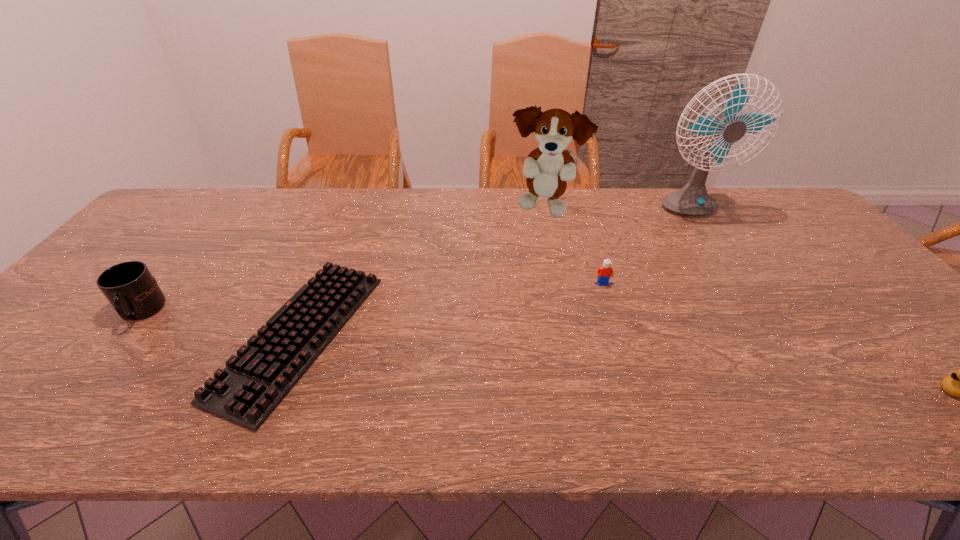
Locate an element on the screen. This screenshot has width=960, height=540. vacant space located 0.080m with the handle on the side of the third tallest object is located at coordinates (103, 359).

The width and height of the screenshot is (960, 540). What are the coordinates of `vacant space located 0.250m on the face of the Lego` in the screenshot? It's located at coord(627,360).

This screenshot has width=960, height=540. I want to click on vacant position located on the left of the shortest object, so click(x=105, y=335).

The height and width of the screenshot is (540, 960). What are the coordinates of `fan present at the far edge` in the screenshot? It's located at (693, 200).

Identify the location of puppy situated at the far edge. Image resolution: width=960 pixels, height=540 pixels. (547, 168).

This screenshot has width=960, height=540. In order to click on object situated at the near edge in this screenshot , I will do `click(253, 383)`.

What are the coordinates of `object that is positioned at the left edge` in the screenshot? It's located at (131, 289).

The width and height of the screenshot is (960, 540). What are the coordinates of `vacant point at the far edge` in the screenshot? It's located at (253, 219).

Locate an element on the screen. The width and height of the screenshot is (960, 540). vacant space at the near edge of the desktop is located at coordinates (578, 428).

Locate an element on the screen. free space at the left edge of the desktop is located at coordinates (14, 379).